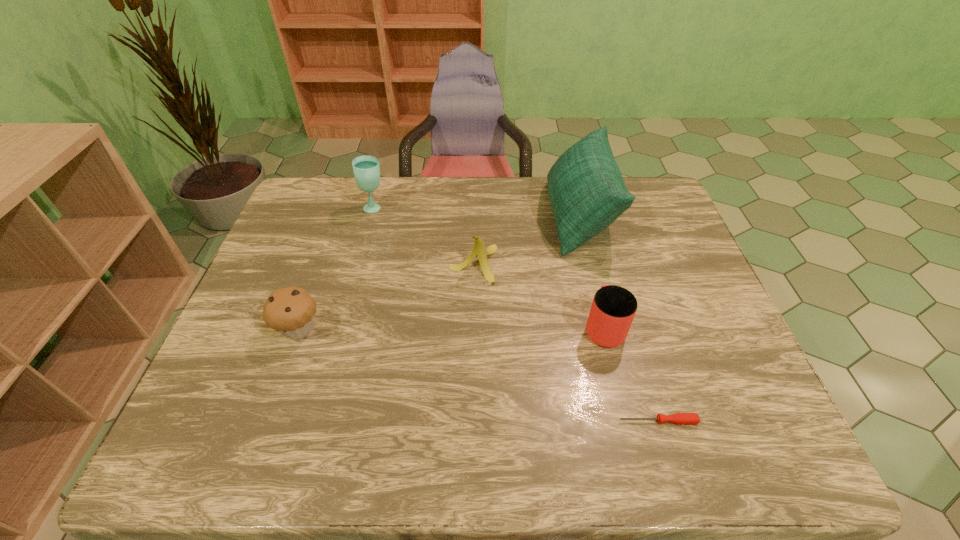
Find the location of a particular element. The image size is (960, 540). free space located 0.270m on the front-facing side of the cushion is located at coordinates (460, 217).

Where is `free space located 0.240m on the right of the fifth object from right to left`? free space located 0.240m on the right of the fifth object from right to left is located at coordinates (461, 207).

I want to click on vacant space located on the left of the fourth object from right to left, so click(424, 264).

Where is `vacant region located 0.050m on the handle side of the cup`? Image resolution: width=960 pixels, height=540 pixels. vacant region located 0.050m on the handle side of the cup is located at coordinates (595, 291).

Where is `free space located 0.300m on the handle side of the cup`? Image resolution: width=960 pixels, height=540 pixels. free space located 0.300m on the handle side of the cup is located at coordinates (580, 231).

Find the location of a particular element. Image resolution: width=960 pixels, height=540 pixels. free location located 0.150m on the handle side of the cup is located at coordinates (588, 265).

What are the coordinates of `free spot located 0.080m on the back of the muffin` in the screenshot? It's located at (314, 287).

Find the location of `vacant space situated at the tip of the shortest object`. vacant space situated at the tip of the shortest object is located at coordinates (552, 421).

Find the location of a particular element. This screenshot has width=960, height=540. free point located 0.360m at the tip of the shortest object is located at coordinates (446, 421).

Locate an element on the screen. vacant region located at the tip of the shortest object is located at coordinates click(576, 421).